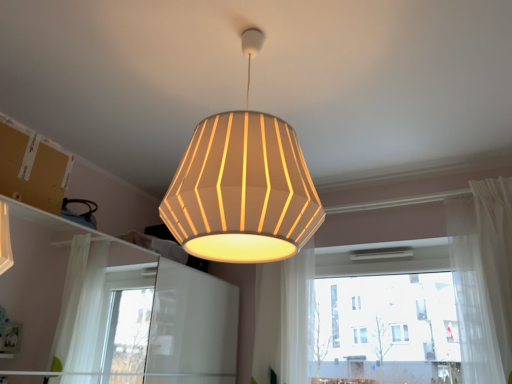
Question: Can you confirm if white sheer curtain at center, the 1th curtain when ordered from left to right, is bigger than brown cardboard at upper left?

Choices:
 (A) yes
 (B) no

Answer: (A)

Question: Could you tell me if white sheer curtain at center, which is counted as the second curtain, starting from the right, is facing brown cardboard at upper left?

Choices:
 (A) no
 (B) yes

Answer: (A)

Question: From the image's perspective, is white sheer curtain at center, the 1th curtain when ordered from left to right, below brown cardboard at upper left?

Choices:
 (A) yes
 (B) no

Answer: (A)

Question: Does white sheer curtain at center, the 1th curtain when ordered from left to right, have a lesser height compared to brown cardboard at upper left?

Choices:
 (A) no
 (B) yes

Answer: (A)

Question: Is white sheer curtain at center, the 1th curtain when ordered from left to right, located outside brown cardboard at upper left?

Choices:
 (A) yes
 (B) no

Answer: (A)

Question: Would you say white sheer curtain at center, which is counted as the second curtain, starting from the right, is to the left or to the right of matte white lampshade at center in the picture?

Choices:
 (A) left
 (B) right

Answer: (B)

Question: Is white sheer curtain at center, the 1th curtain when ordered from left to right, spatially inside matte white lampshade at center, or outside of it?

Choices:
 (A) inside
 (B) outside

Answer: (B)

Question: From a real-world perspective, relative to matte white lampshade at center, is white sheer curtain at center, the 1th curtain when ordered from left to right, vertically above or below?

Choices:
 (A) above
 (B) below

Answer: (B)

Question: Relative to matte white lampshade at center, is white sheer curtain at center, which is counted as the second curtain, starting from the right, in front or behind?

Choices:
 (A) behind
 (B) front

Answer: (A)

Question: Based on their positions, is brown cardboard at upper left located to the left or right of white glass window at center?

Choices:
 (A) left
 (B) right

Answer: (A)

Question: Is brown cardboard at upper left in front of or behind white glass window at center in the image?

Choices:
 (A) front
 (B) behind

Answer: (A)

Question: From a real-world perspective, relative to white glass window at center, is brown cardboard at upper left vertically above or below?

Choices:
 (A) below
 (B) above

Answer: (B)

Question: Is brown cardboard at upper left inside the boundaries of white glass window at center, or outside?

Choices:
 (A) outside
 (B) inside

Answer: (A)

Question: Based on their sizes in the image, would you say white sheer curtain at center, the 1th curtain when ordered from left to right, is bigger or smaller than white glass window at center?

Choices:
 (A) big
 (B) small

Answer: (B)

Question: Considering their positions, is white sheer curtain at center, the 1th curtain when ordered from left to right, located in front of or behind white glass window at center?

Choices:
 (A) front
 (B) behind

Answer: (B)